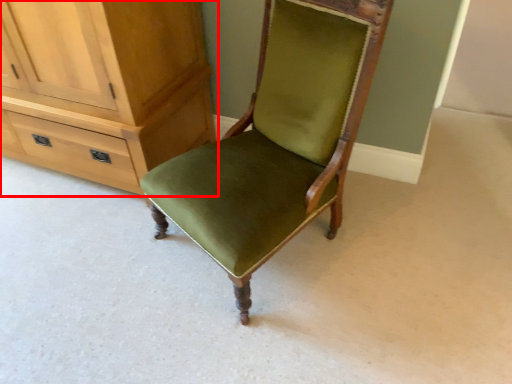
Question: From the image's perspective, where is cabinetry (annotated by the red box) located in relation to chair in the image?

Choices:
 (A) below
 (B) above

Answer: (B)